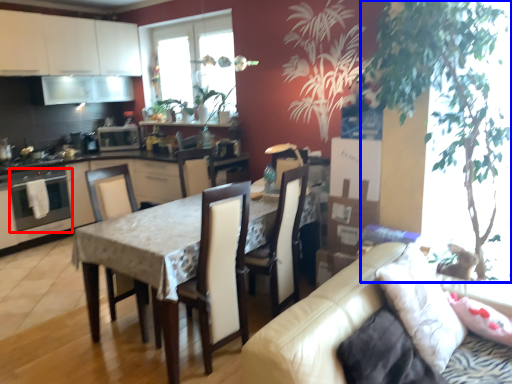
Question: Which point is closer to the camera, oven (highlighted by a red box) or plant (highlighted by a blue box)?

Choices:
 (A) oven
 (B) plant

Answer: (B)